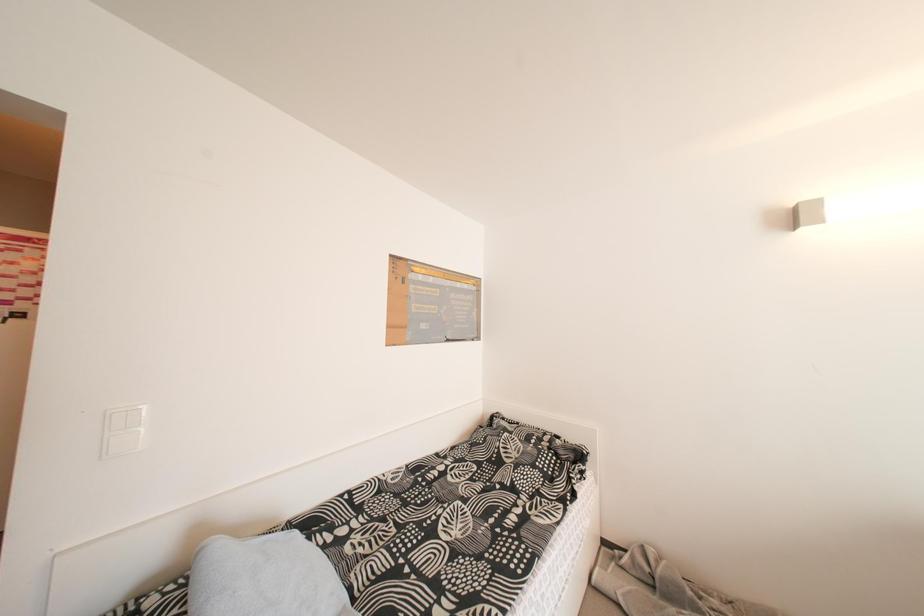
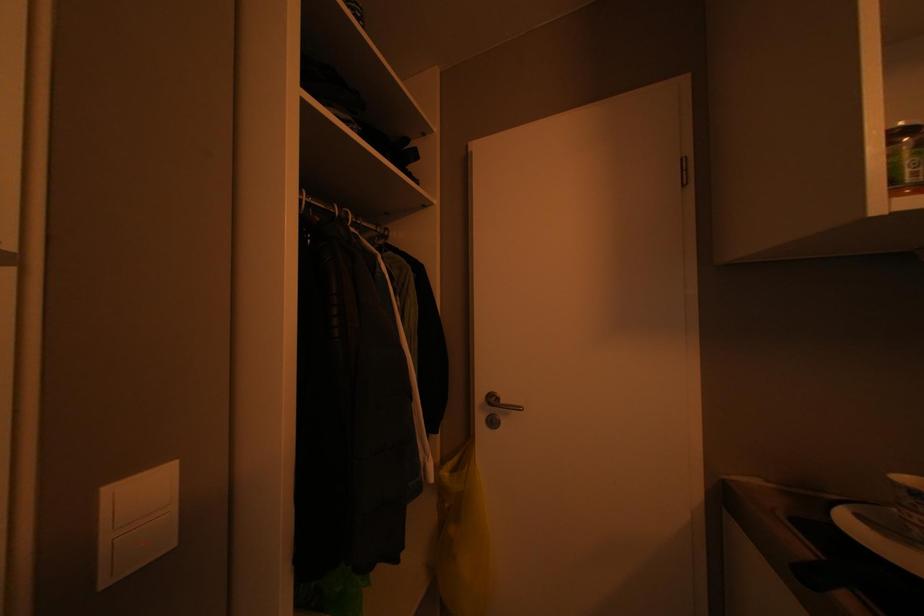
Which direction would the cameraman need to move to produce the second image?

The cameraman moved toward left, forward.